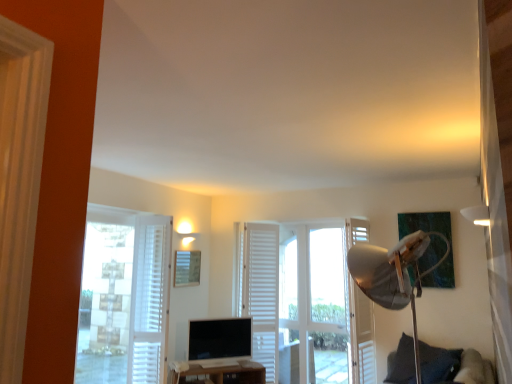
At what (x,y) coordinates should I click in order to perform the action: click on vacant region under matte black computer monitor at center (from a real-world perspective). Please return your answer as a coordinate pair (x, y). Looking at the image, I should click on (217, 360).